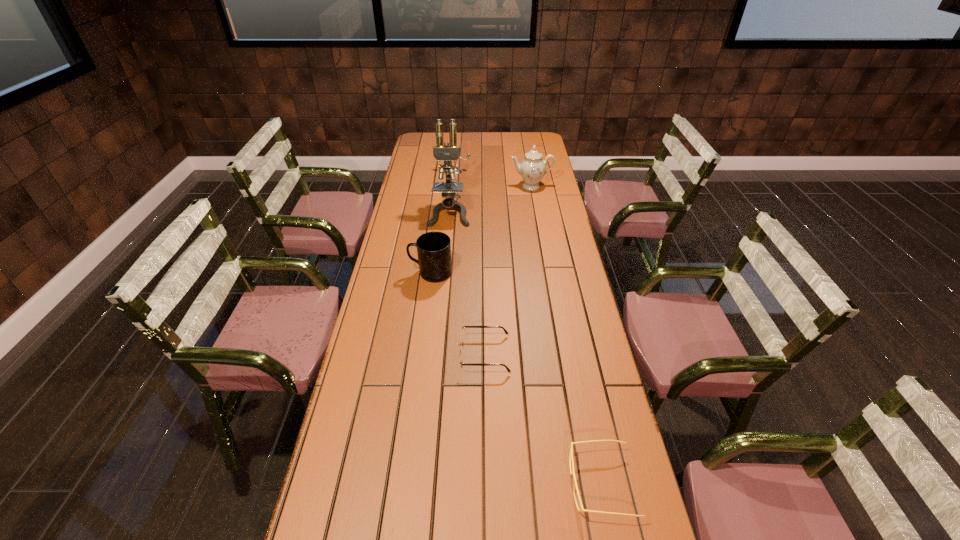
Image resolution: width=960 pixels, height=540 pixels. What are the coordinates of `microscope present at the left edge` in the screenshot? It's located at (447, 153).

Image resolution: width=960 pixels, height=540 pixels. Identify the location of mug at the left edge. (433, 248).

The height and width of the screenshot is (540, 960). Find the location of `chinaware that is at the right edge`. chinaware that is at the right edge is located at coordinates click(532, 168).

Where is `spectacles that is at the right edge`? spectacles that is at the right edge is located at coordinates (571, 448).

You are a GUI agent. You are given a task and a screenshot of the screen. Output one action in this format:
    pyautogui.click(x=<x>, y=<y>)
    Task: Click on the blank space at the far edge
    This screenshot has height=540, width=960.
    Given the screenshot: What is the action you would take?
    pyautogui.click(x=504, y=135)

At what (x,y) coordinates should I click in order to perform the action: click on vacant space at the left edge of the desktop. Please return your answer as a coordinate pair (x, y). Looking at the image, I should click on (395, 359).

In the image, there is a desktop. Where is `vacant space at the right edge`? Image resolution: width=960 pixels, height=540 pixels. vacant space at the right edge is located at coordinates 552,301.

I want to click on free region at the far left corner of the desktop, so tap(420, 138).

You are a GUI agent. You are given a task and a screenshot of the screen. Output one action in this format:
    pyautogui.click(x=<x>, y=<y>)
    Task: Click on the free space at the far right corner of the desktop
    
    Given the screenshot: What is the action you would take?
    pyautogui.click(x=527, y=145)

The width and height of the screenshot is (960, 540). I want to click on free space that is in between the farther spectacles and the fourth nearest object, so click(x=467, y=284).